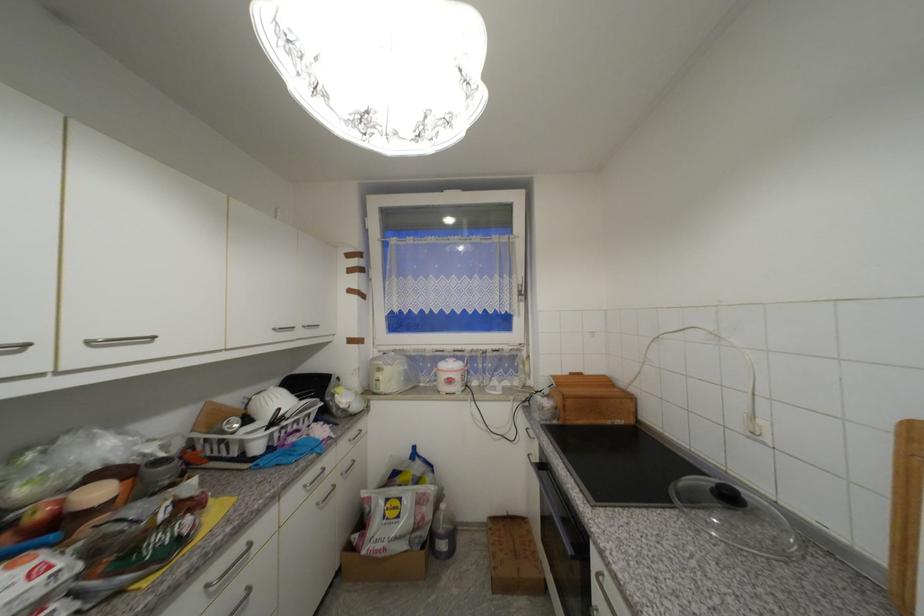
Locate an element on the screen. white window handle is located at coordinates (524, 298).